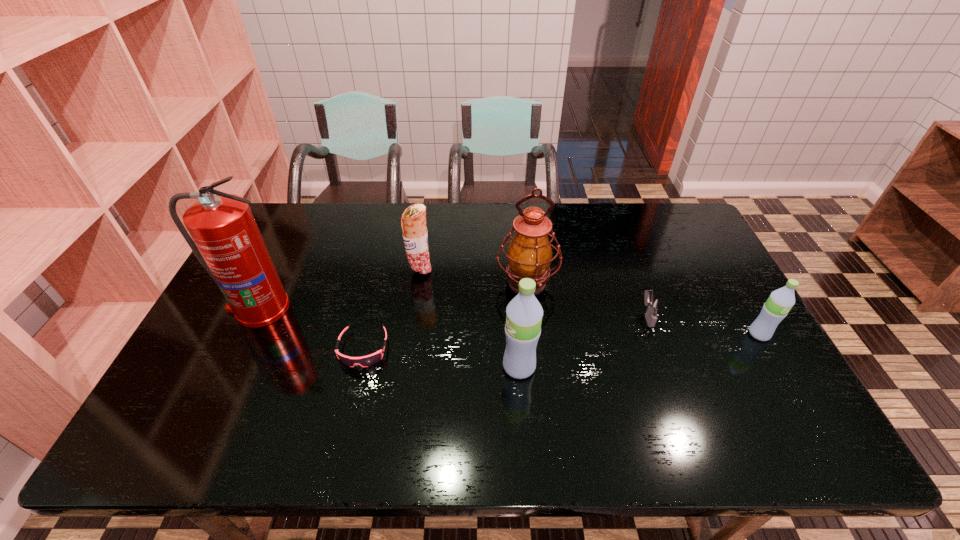
Locate an element on the screen. free point that keeps the water bottles evenly spaced on the left is located at coordinates (244, 404).